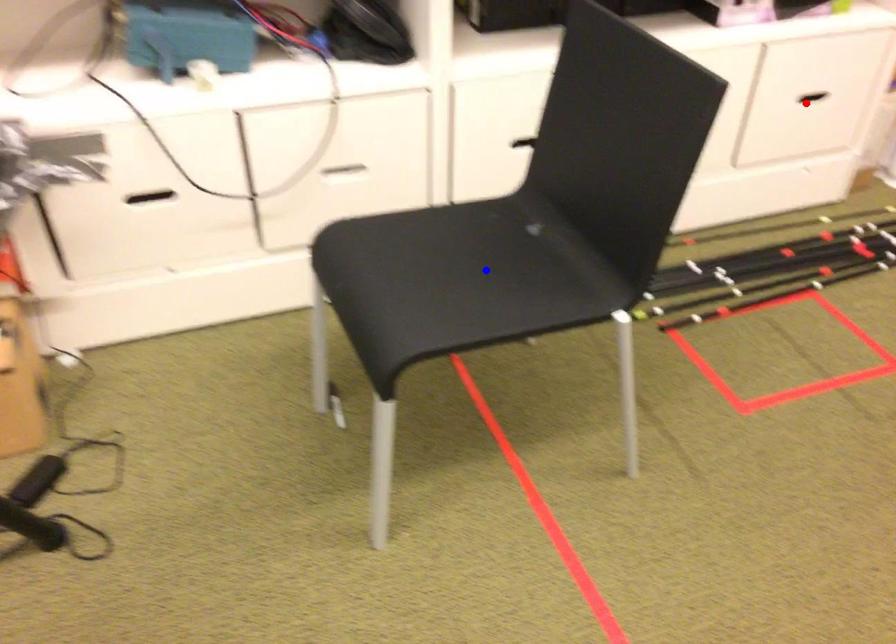
Question: In the image, two points are highlighted. Which point is nearer to the camera? Reply with the corresponding letter.

Choices:
 (A) blue point
 (B) red point

Answer: (A)